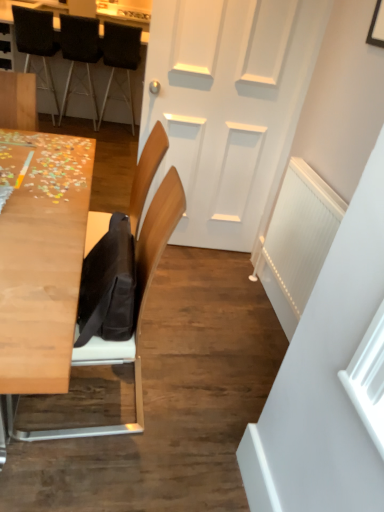
At what (x,y) coordinates should I click in order to perform the action: click on vacant space underneath wooden chair at left, which is counted as the fourth chair, starting from the back (from a real-world perspective). Please return your answer as a coordinate pair (x, y). Looking at the image, I should click on click(x=115, y=391).